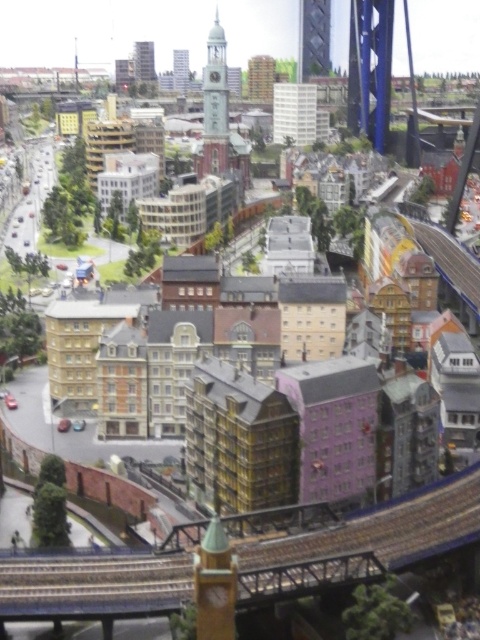
You are a model train engineer observing the miniature cityscape. You notice the gold metallic clock tower at center and the shiny glass tower at upper center. Which of these two structures is positioned higher in the image?

The shiny glass tower at upper center is positioned higher in the image than the gold metallic clock tower at center.

You are an architect analyzing the miniature cityscape. You notice two towers at the upper center of the scene. Which one is taller between the shiny glass tower at upper center and the metallic silver tower at upper center?

The shiny glass tower at upper center is much taller than the metallic silver tower at upper center.

You are a model train engineer observing the miniature cityscape. You notice the gold metallic clock tower at center and the shiny glass tower at upper center. Which of these two structures is taller?

The gold metallic clock tower at center is taller than the shiny glass tower at upper center according to the description.